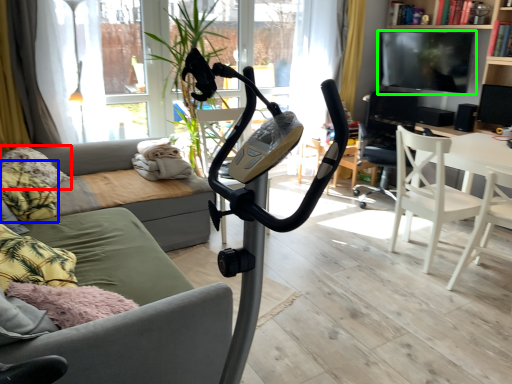
Question: Which object is positioned closest to pillow (highlighted by a red box)? Select from pillow (highlighted by a blue box) and television (highlighted by a green box).

Choices:
 (A) pillow
 (B) television

Answer: (A)